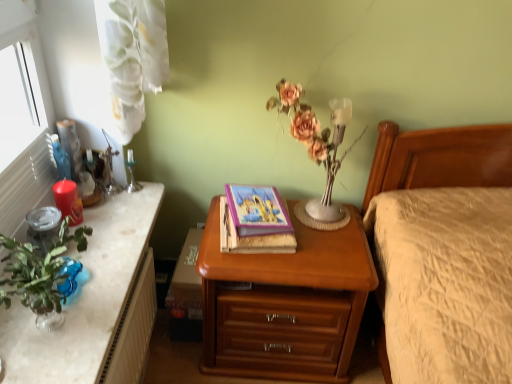
Question: Is matte purple book at center next to white textured radiator at lower left and touching it?

Choices:
 (A) yes
 (B) no

Answer: (B)

Question: Can you confirm if matte purple book at center is shorter than white textured radiator at lower left?

Choices:
 (A) yes
 (B) no

Answer: (A)

Question: From a real-world perspective, is matte purple book at center physically above white textured radiator at lower left?

Choices:
 (A) yes
 (B) no

Answer: (A)

Question: Does matte purple book at center have a larger size compared to white textured radiator at lower left?

Choices:
 (A) yes
 (B) no

Answer: (B)

Question: Is white textured radiator at lower left at the back of matte purple book at center?

Choices:
 (A) no
 (B) yes

Answer: (A)

Question: Considering the relative positions of matte purple book at center and white textured radiator at lower left in the image provided, is matte purple book at center in front of white textured radiator at lower left?

Choices:
 (A) yes
 (B) no

Answer: (B)

Question: From a real-world perspective, is matte pink flowers at center located higher than silver metallic candle holder at upper left?

Choices:
 (A) no
 (B) yes

Answer: (B)

Question: Is matte pink flowers at center completely or partially outside of silver metallic candle holder at upper left?

Choices:
 (A) yes
 (B) no

Answer: (A)

Question: Can you confirm if matte pink flowers at center is smaller than silver metallic candle holder at upper left?

Choices:
 (A) yes
 (B) no

Answer: (B)

Question: From a real-world perspective, is matte pink flowers at center under silver metallic candle holder at upper left?

Choices:
 (A) yes
 (B) no

Answer: (B)

Question: Considering the relative positions of matte pink flowers at center and silver metallic candle holder at upper left in the image provided, is matte pink flowers at center to the left of silver metallic candle holder at upper left from the viewer's perspective?

Choices:
 (A) no
 (B) yes

Answer: (A)

Question: From the image's perspective, is matte pink flowers at center over silver metallic candle holder at upper left?

Choices:
 (A) no
 (B) yes

Answer: (B)

Question: Can you confirm if white textured radiator at lower left is smaller than matte pink flowers at center?

Choices:
 (A) no
 (B) yes

Answer: (B)